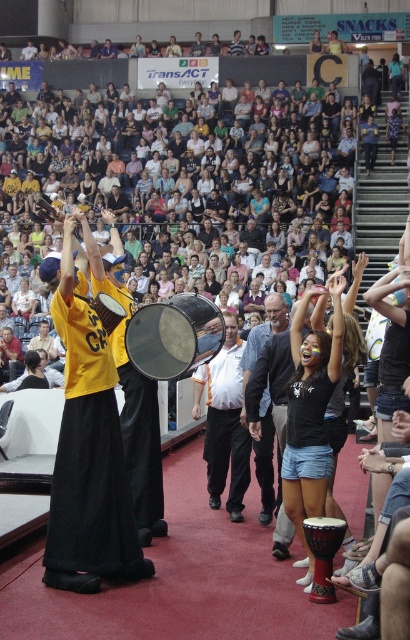
Question: Does shiny metallic drum at center appear on the left side of brown wooden drum at lower center?

Choices:
 (A) yes
 (B) no

Answer: (A)

Question: Which of the following is the farthest from the observer?

Choices:
 (A) brown wooden drum at lower center
 (B) gray fabric jacket at center
 (C) shiny metallic drum at center

Answer: (C)

Question: Considering the relative positions of shiny metallic drum at center and gray fabric jacket at center in the image provided, where is shiny metallic drum at center located with respect to gray fabric jacket at center?

Choices:
 (A) below
 (B) above

Answer: (B)

Question: Which object is closer to the camera taking this photo?

Choices:
 (A) gray fabric jacket at center
 (B) shiny metallic drum at center

Answer: (A)

Question: Is shiny metallic drum at center smaller than gray fabric jacket at center?

Choices:
 (A) yes
 (B) no

Answer: (A)

Question: Which of the following is the farthest from the observer?

Choices:
 (A) (264, 301)
 (B) (227, 413)
 (C) (152, 339)
 (D) (323, 600)

Answer: (A)